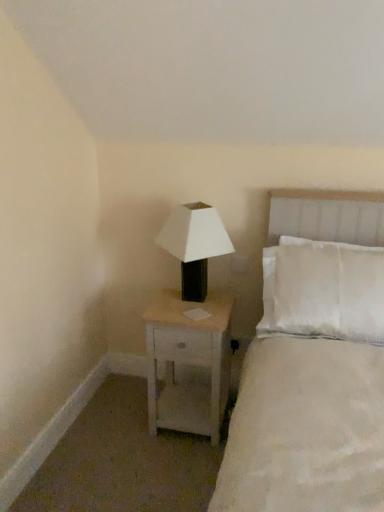
Find the location of `free point above white wood nightstand at center (from a real-world perspective)`. free point above white wood nightstand at center (from a real-world perspective) is located at coordinates [x=198, y=308].